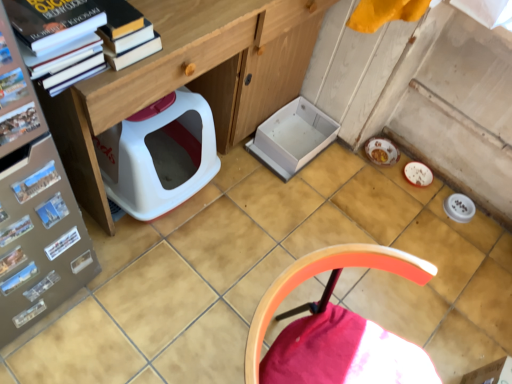
Question: Based on their positions, is wooden chair at lower right located to the left or right of metallic glossy magazine at lower left, which is the 4th magazine in back-to-front order?

Choices:
 (A) left
 (B) right

Answer: (B)

Question: Is wooden chair at lower right wider or thinner than metallic glossy magazine at lower left, which is the 4th magazine in back-to-front order?

Choices:
 (A) thin
 (B) wide

Answer: (B)

Question: Which of these objects is positioned closest to the metallic silver magazine at lower left, the first magazine positioned from the back?

Choices:
 (A) wooden chair at lower right
 (B) metallic glossy magazine at lower left, which ranks as the fifth magazine in back-to-front order
 (C) matte wood desk at center
 (D) matte cardboard magazine at left, the seventh magazine when ordered from back to front
 (E) metallic glossy magazine at lower left, the 6th magazine when ordered from front to back

Answer: (E)

Question: Estimate the real-world distances between objects in this image. Which object is closer to the metallic glossy magazine at lower left, arranged as the 4th magazine when viewed from the front?

Choices:
 (A) wooden chair at lower right
 (B) metallic silver magazine at left, which is the fifth magazine in front-to-back order
 (C) white matte book at lower left, marked as the 2th book in a top-to-bottom arrangement
 (D) metallic glossy magazine at left, which ranks as the 6th magazine in back-to-front order
 (E) blue matte postcard at left, the second paperback book in the bottom-to-top sequence

Answer: (B)